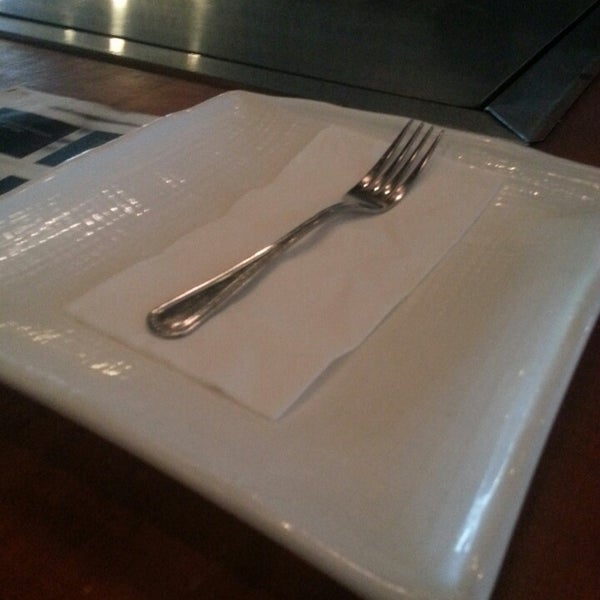
Image resolution: width=600 pixels, height=600 pixels. What are the coordinates of `napkin under plate` in the screenshot? It's located at click(x=42, y=133).